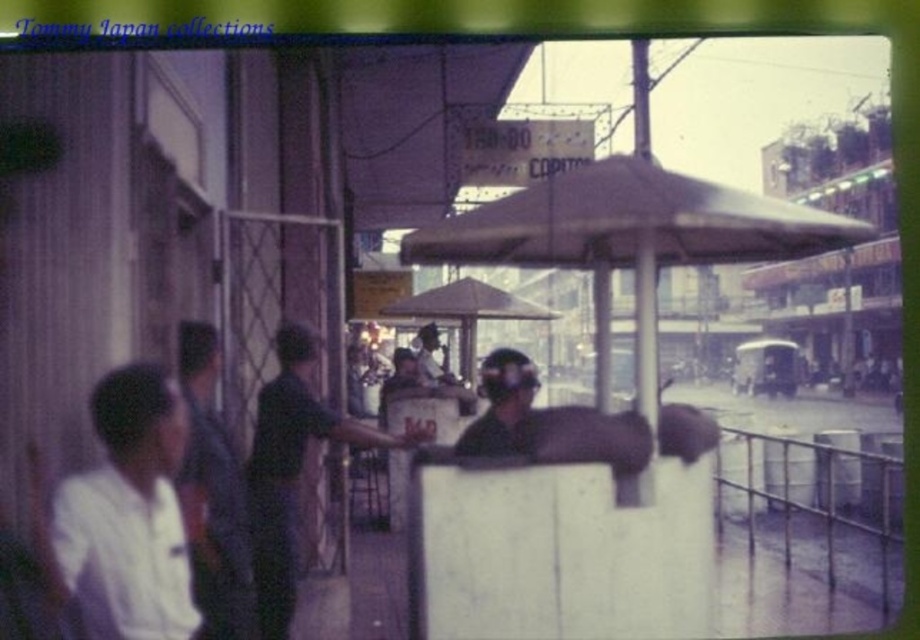
Question: Which point is closer to the camera taking this photo?

Choices:
 (A) (420, 364)
 (B) (125, 499)
 (C) (205, 480)
 (D) (479, 285)

Answer: (B)

Question: Does white cotton shirt at lower left have a greater width compared to brown matte umbrella at center?

Choices:
 (A) no
 (B) yes

Answer: (A)

Question: Which is nearer to the brown matte umbrella at center?

Choices:
 (A) matte brown umbrella at center
 (B) dark blue shirt at center
 (C) dark green shirt at center

Answer: (B)

Question: Estimate the real-world distances between objects in this image. Which object is closer to the dark blue shirt at left?

Choices:
 (A) matte brown umbrella at center
 (B) dark blue shirt at center
 (C) white cotton shirt at lower left
 (D) brown matte umbrella at center

Answer: (C)

Question: Observing the image, what is the correct spatial positioning of dark green shirt at center in reference to brown matte umbrella at center?

Choices:
 (A) below
 (B) above

Answer: (A)

Question: Observing the image, what is the correct spatial positioning of matte brown umbrella at center in reference to white cotton shirt at lower left?

Choices:
 (A) above
 (B) below

Answer: (A)